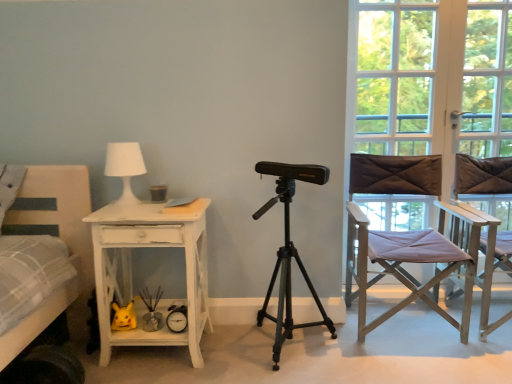
Identify the location of vacant space to the left of metallic tripod at center. The width and height of the screenshot is (512, 384). (232, 357).